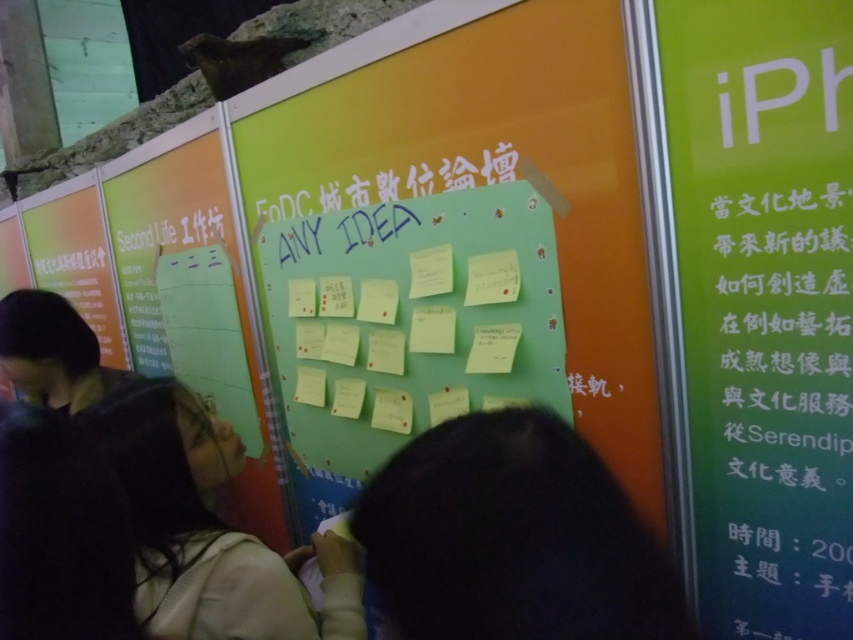
Question: Can you confirm if green paper at right is positioned to the right of dark hair at center?

Choices:
 (A) no
 (B) yes

Answer: (B)

Question: Can you confirm if dark hair at center is positioned to the left of light beige sweater at center?

Choices:
 (A) no
 (B) yes

Answer: (A)

Question: Which point appears closest to the camera in this image?

Choices:
 (A) (212, 513)
 (B) (622, 609)
 (C) (285, 282)

Answer: (B)

Question: In this image, where is green paper at right located relative to black fabric at lower left?

Choices:
 (A) right
 (B) left

Answer: (A)

Question: Which point is farther to the camera?

Choices:
 (A) dark hair at center
 (B) green paper at right
 (C) green matte bulletin board at center
 (D) black fabric at lower left

Answer: (C)

Question: Which point appears farthest from the camera in this image?

Choices:
 (A) (212, 451)
 (B) (801, 237)
 (C) (595, 502)

Answer: (A)